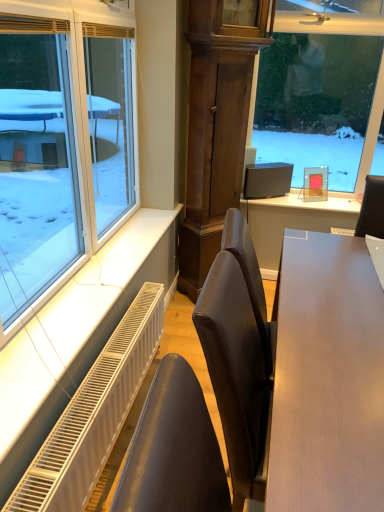
What do you see at coordinates (327, 378) in the screenshot? The height and width of the screenshot is (512, 384). I see `light brown wooden table at center` at bounding box center [327, 378].

This screenshot has width=384, height=512. What do you see at coordinates (93, 414) in the screenshot? I see `white metal radiator at lower left` at bounding box center [93, 414].

Describe the element at coordinates (62, 144) in the screenshot. I see `clear glass window at left` at that location.

The image size is (384, 512). Identify the location of satin black monitor at upper center. (267, 180).

Considering the positions of point (122, 155) and point (250, 165), is point (122, 155) closer or farther from the camera than point (250, 165)?

Point (122, 155).

Where is `window in front of the satin black monitor at upper center`? window in front of the satin black monitor at upper center is located at coordinates (62, 144).

Can you confirm if clear glass window at left is positioned to the left of satin black monitor at upper center?

Yes, clear glass window at left is to the left of satin black monitor at upper center.

Between satin black monitor at upper center and light brown wooden table at center, which one is positioned behind?

satin black monitor at upper center is more distant.

Based on the photo, which is more to the left, satin black monitor at upper center or light brown wooden table at center?

satin black monitor at upper center.

Is satin black monitor at upper center oriented towards light brown wooden table at center?

Yes, satin black monitor at upper center faces towards light brown wooden table at center.

Is satin black monitor at upper center not near clear glass window at left?

satin black monitor at upper center is positioned a significant distance from clear glass window at left.

Based on their positions, is satin black monitor at upper center located to the left or right of clear glass window at left?

From the image, it's evident that satin black monitor at upper center is to the right of clear glass window at left.

Considering the sizes of satin black monitor at upper center and clear glass window at left in the image, is satin black monitor at upper center bigger or smaller than clear glass window at left?

Clearly, satin black monitor at upper center is smaller in size than clear glass window at left.

Is white metal radiator at lower left in contact with light brown wooden table at center?

white metal radiator at lower left and light brown wooden table at center are not in contact.

How different are the orientations of white metal radiator at lower left and light brown wooden table at center in degrees?

The angular difference between white metal radiator at lower left and light brown wooden table at center is 0.633 degrees.

From the image's perspective, is white metal radiator at lower left positioned above or below light brown wooden table at center?

Clearly, from the image's perspective, white metal radiator at lower left is below light brown wooden table at center.

Measure the distance between white metal radiator at lower left and light brown wooden table at center.

27.94 inches.

From the image's perspective, is light brown wooden table at center above or below clear glass window at left?

light brown wooden table at center is below clear glass window at left.

Looking at their sizes, would you say light brown wooden table at center is wider or thinner than clear glass window at left?

Clearly, light brown wooden table at center has more width compared to clear glass window at left.

Which is farther from the camera, (370, 271) or (50, 225)?

The point (50, 225) is farther.

Does light brown wooden table at center have a larger size compared to clear glass window at left?

Correct, light brown wooden table at center is larger in size than clear glass window at left.

Does point (107, 113) lie behind point (355, 487)?

That is True.

From a real-world perspective, is clear glass window at left above or below light brown wooden table at center?

In terms of real-world spatial position, clear glass window at left is above light brown wooden table at center.

Is clear glass window at left facing away from light brown wooden table at center?

No.

How distant is clear glass window at left from light brown wooden table at center?

clear glass window at left and light brown wooden table at center are 1.12 meters apart from each other.

Which is more to the right, white metal radiator at lower left or satin black monitor at upper center?

From the viewer's perspective, satin black monitor at upper center appears more on the right side.

From the image's perspective, is white metal radiator at lower left below satin black monitor at upper center?

Yes, from the image's perspective, white metal radiator at lower left is below satin black monitor at upper center.

Can we say white metal radiator at lower left lies outside satin black monitor at upper center?

Indeed, white metal radiator at lower left is completely outside satin black monitor at upper center.

Considering the relative sizes of white metal radiator at lower left and satin black monitor at upper center in the image provided, is white metal radiator at lower left wider than satin black monitor at upper center?

No, white metal radiator at lower left is not wider than satin black monitor at upper center.

Where is `window on the left of the satin black monitor at upper center`? The width and height of the screenshot is (384, 512). window on the left of the satin black monitor at upper center is located at coordinates (62, 144).

The width and height of the screenshot is (384, 512). What are the coordinates of `table located below the satin black monitor at upper center (from the image's perspective)` in the screenshot? It's located at pyautogui.click(x=327, y=378).

Considering their positions, is white metal radiator at lower left positioned closer to clear glass window at left than satin black monitor at upper center?

white metal radiator at lower left is positioned closer to the anchor clear glass window at left.

Based on their spatial positions, is white metal radiator at lower left or light brown wooden table at center closer to clear glass window at left?

white metal radiator at lower left lies closer to clear glass window at left than the other object.

Estimate the real-world distances between objects in this image. Which object is closer to light brown wooden table at center, satin black monitor at upper center or clear glass window at left?

clear glass window at left is closer to light brown wooden table at center.

Estimate the real-world distances between objects in this image. Which object is further from satin black monitor at upper center, light brown wooden table at center or white metal radiator at lower left?

Based on the image, light brown wooden table at center appears to be further to satin black monitor at upper center.

Estimate the real-world distances between objects in this image. Which object is closer to white metal radiator at lower left, light brown wooden table at center or satin black monitor at upper center?

Based on the image, light brown wooden table at center appears to be nearer to white metal radiator at lower left.

Looking at the image, which one is located closer to white metal radiator at lower left, clear glass window at left or satin black monitor at upper center?

clear glass window at left lies closer to white metal radiator at lower left than the other object.

When comparing their distances from light brown wooden table at center, does clear glass window at left or satin black monitor at upper center seem closer?

Among the two, clear glass window at left is located nearer to light brown wooden table at center.

Based on their spatial positions, is white metal radiator at lower left or clear glass window at left further from light brown wooden table at center?

clear glass window at left lies further to light brown wooden table at center than the other object.

Identify the location of window between light brown wooden table at center and satin black monitor at upper center along the z-axis. The width and height of the screenshot is (384, 512). [x=62, y=144].

This screenshot has width=384, height=512. What are the coordinates of `radiator positioned between clear glass window at left and satin black monitor at upper center from near to far` in the screenshot? It's located at (93, 414).

Locate an element on the screen. The height and width of the screenshot is (512, 384). table between clear glass window at left and white metal radiator at lower left in the vertical direction is located at coordinates (327, 378).

Locate an element on the screen. The width and height of the screenshot is (384, 512). radiator between light brown wooden table at center and satin black monitor at upper center in the front-back direction is located at coordinates (93, 414).